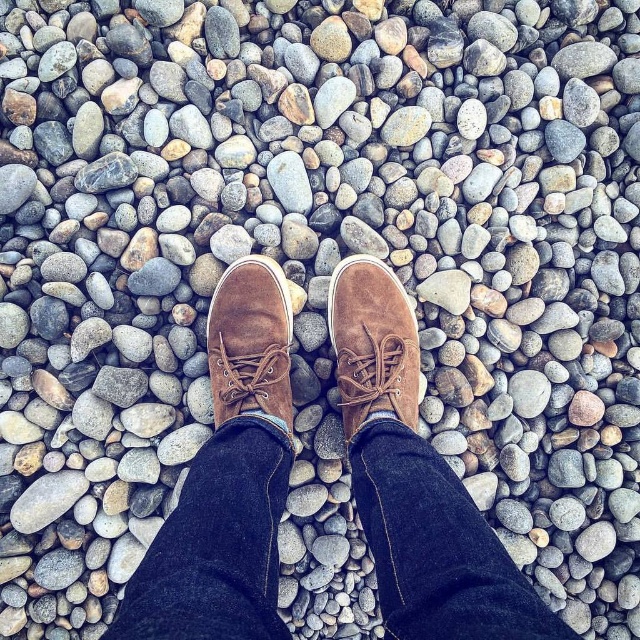
Question: Is suede brown shoe at center positioned before suede brown boot at center?

Choices:
 (A) no
 (B) yes

Answer: (A)

Question: Does suede brown shoe at center come behind suede brown boot at center?

Choices:
 (A) no
 (B) yes

Answer: (B)

Question: Does denim at center appear on the right side of suede brown boot at center?

Choices:
 (A) no
 (B) yes

Answer: (B)

Question: Estimate the real-world distances between objects in this image. Which object is farther from the suede brown shoe at center?

Choices:
 (A) denim at center
 (B) suede brown boot at center

Answer: (A)

Question: Among these points, which one is farthest from the camera?

Choices:
 (A) (234, 632)
 (B) (205, 333)

Answer: (B)

Question: Which of the following is the farthest from the observer?

Choices:
 (A) (403, 371)
 (B) (243, 326)
 (C) (516, 616)

Answer: (B)